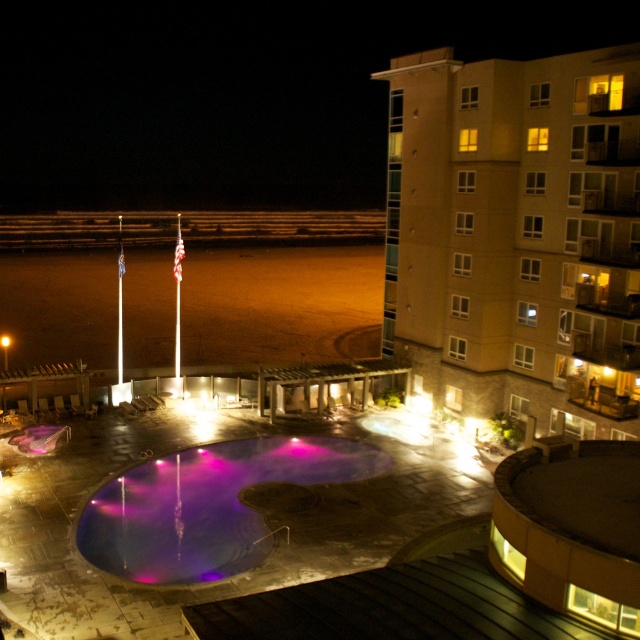
Question: Where is beige concrete building at upper right located in relation to purple reflective pool at center in the image?

Choices:
 (A) below
 (B) above

Answer: (B)

Question: Does beige concrete building at upper right have a smaller size compared to purple reflective pool at center?

Choices:
 (A) no
 (B) yes

Answer: (A)

Question: Can you confirm if beige concrete building at upper right is positioned to the left of purple reflective pool at center?

Choices:
 (A) no
 (B) yes

Answer: (A)

Question: Which point is closer to the camera?

Choices:
 (A) beige concrete building at upper right
 (B) purple reflective pool at center

Answer: (B)

Question: Which of the following is the closest to the observer?

Choices:
 (A) (333, 452)
 (B) (579, 221)

Answer: (B)